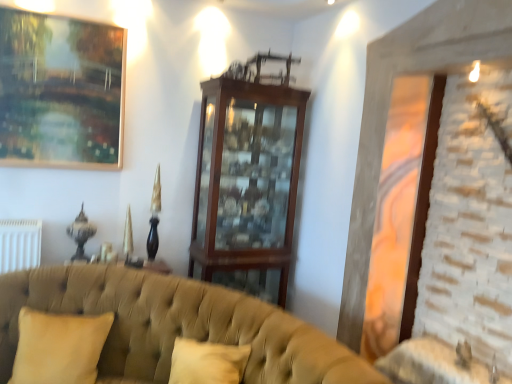
Question: Considering the relative positions of gold-framed painting at upper left and tufted fabric couch at lower left in the image provided, is gold-framed painting at upper left to the left or to the right of tufted fabric couch at lower left?

Choices:
 (A) left
 (B) right

Answer: (A)

Question: Based on their sizes in the image, would you say gold-framed painting at upper left is bigger or smaller than tufted fabric couch at lower left?

Choices:
 (A) big
 (B) small

Answer: (B)

Question: Which of these objects is positioned closest to the gold-framed painting at upper left?

Choices:
 (A) tufted fabric couch at lower left
 (B) beige fabric pillow at lower left
 (C) wooden cabinet at center

Answer: (C)

Question: Which is farther from the tufted fabric couch at lower left?

Choices:
 (A) gold-framed painting at upper left
 (B) beige fabric pillow at lower left
 (C) wooden cabinet at center

Answer: (A)